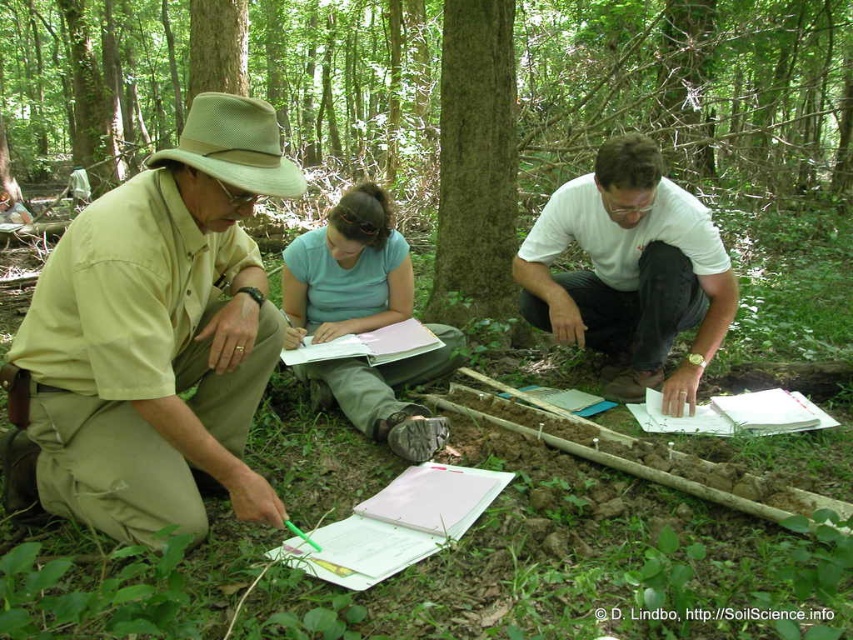
Where is the khaki cotton shirt at center located?

The khaki cotton shirt at center is located at point (157,336).

Based on the scene description, where is the khaki cotton shirt at center positioned relative to the other objects?

The khaki cotton shirt at center is located at point (157, 336).